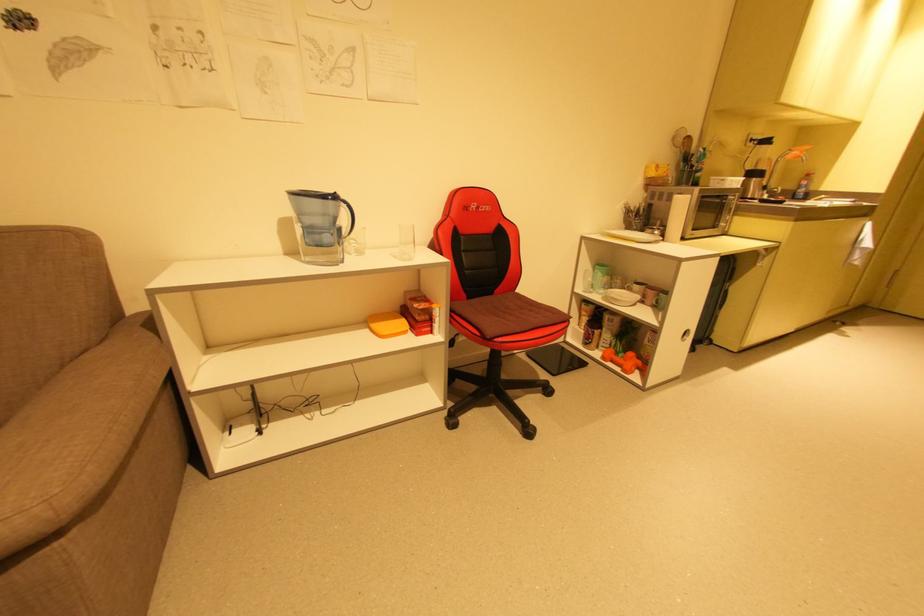
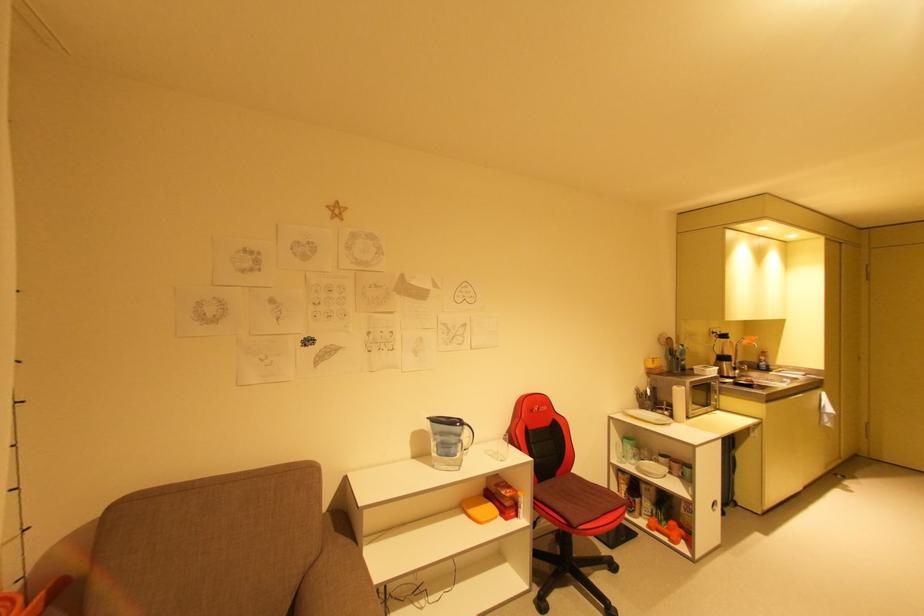
In the second image, find the point that corresponds to (x=346, y=204) in the first image.

(469, 427)